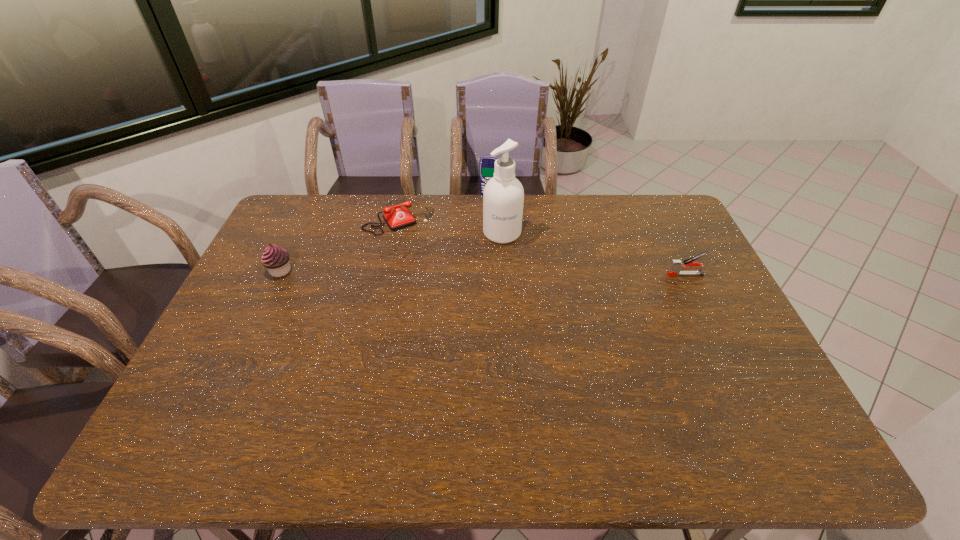
Find the location of `vacant region at the near right corner`. vacant region at the near right corner is located at coordinates (777, 400).

Locate an element on the screen. The height and width of the screenshot is (540, 960). vacant space that's between the leftmost object and the cellular telephone is located at coordinates (384, 233).

Where is `vacant space in between the cellular telephone and the telephone`? vacant space in between the cellular telephone and the telephone is located at coordinates (444, 207).

Image resolution: width=960 pixels, height=540 pixels. I want to click on vacant region between the cellular telephone and the cupcake, so click(x=384, y=233).

You are a GUI agent. You are given a task and a screenshot of the screen. Output one action in this format:
    pyautogui.click(x=<x>, y=<y>)
    Task: Click on the free space between the third shortest object and the telephone
    The image size is (960, 540).
    Given the screenshot: What is the action you would take?
    pyautogui.click(x=340, y=245)

What are the coordinates of `unoccupied area between the third tallest object and the second shortest object` in the screenshot? It's located at (483, 273).

Locate an element on the screen. The width and height of the screenshot is (960, 540). unoccupied position between the tallest object and the second object from left to right is located at coordinates (450, 226).

The image size is (960, 540). I want to click on free space between the fourth shortest object and the stapler, so click(x=588, y=235).

Identify the location of free space between the cellular telephone and the rightmost object. (588, 235).

Identify the location of blank region between the cleansing agent and the cupcake. Image resolution: width=960 pixels, height=540 pixels. (391, 252).